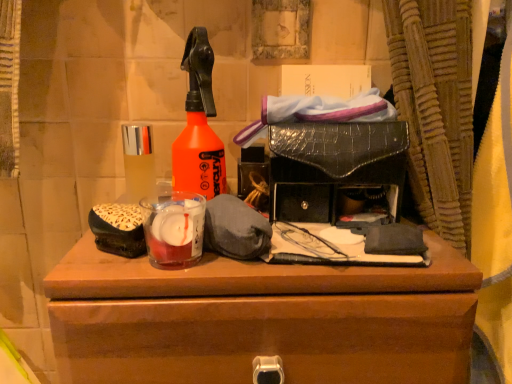
Question: Is translucent glass candle at center to the left or to the right of translucent glass bottle at center left in the image?

Choices:
 (A) right
 (B) left

Answer: (A)

Question: Choose the correct answer: Is translucent glass candle at center inside translucent glass bottle at center left or outside it?

Choices:
 (A) outside
 (B) inside

Answer: (A)

Question: Based on their relative distances, which object is farther from the brown wooden chest of drawers at center?

Choices:
 (A) translucent glass candle at center
 (B) translucent glass bottle at center left

Answer: (B)

Question: Which object is positioned farthest from the brown wooden chest of drawers at center?

Choices:
 (A) translucent glass candle at center
 (B) translucent glass bottle at center left

Answer: (B)